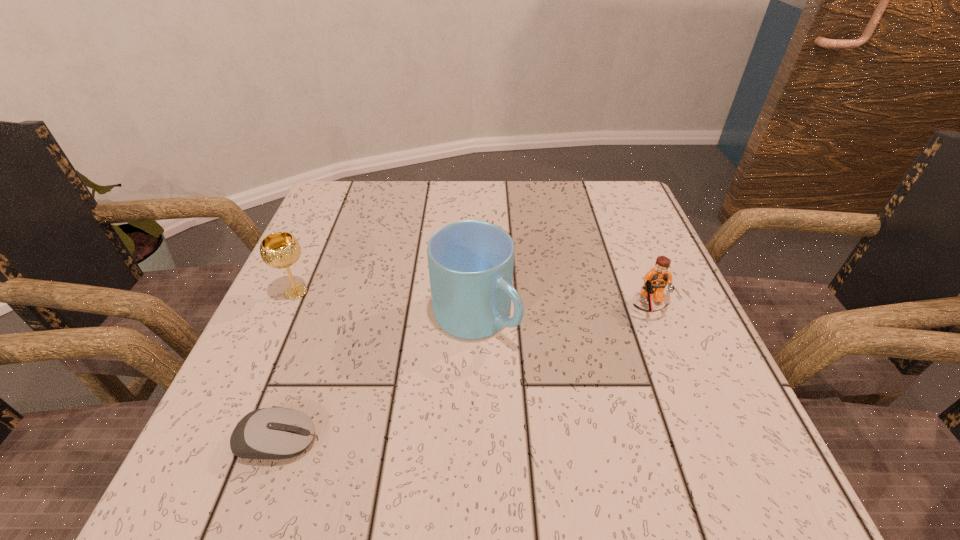
Where is `mug`? mug is located at coordinates (470, 262).

Locate an element on the screen. This screenshot has height=540, width=960. the tallest object is located at coordinates (470, 262).

Image resolution: width=960 pixels, height=540 pixels. In order to click on the third shortest object in this screenshot , I will do `click(279, 250)`.

What are the coordinates of `the rightmost object` in the screenshot? It's located at (655, 281).

Find the location of a particular element. The image size is (960, 540). the second shortest object is located at coordinates (655, 281).

Where is `the shortest object`? Image resolution: width=960 pixels, height=540 pixels. the shortest object is located at coordinates (275, 433).

Locate an element on the screen. computer equipment is located at coordinates (275, 433).

Find the location of a particular element. This screenshot has width=960, height=540. free space located on the back of the tallest object is located at coordinates (476, 221).

The height and width of the screenshot is (540, 960). Find the location of `vacant space situated 0.260m on the right of the chalice`. vacant space situated 0.260m on the right of the chalice is located at coordinates (444, 292).

This screenshot has height=540, width=960. In order to click on vacant area situated holding a crossbow in the hands of the rightmost object in this screenshot , I will do `click(726, 496)`.